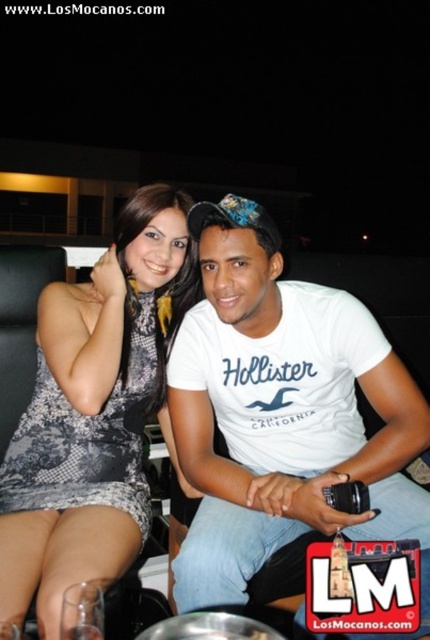
Based on the photo, you are standing in a dimly lit indoor setting, possibly a bar or lounge. You see two people seated closely together. The person on the left is wearing a sleeveless patterned dress, and the person on the right is wearing a white Hollister California t shirt. There is a point at coordinates (x=282, y=412). Which object is this point located on?

The point at (x=282, y=412) is located on the white cotton t shirt at center.